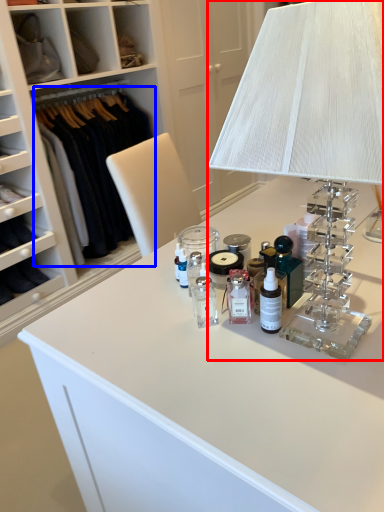
Question: Which point is further to the camera, table lamp (highlighted by a red box) or clothing (highlighted by a blue box)?

Choices:
 (A) table lamp
 (B) clothing

Answer: (B)